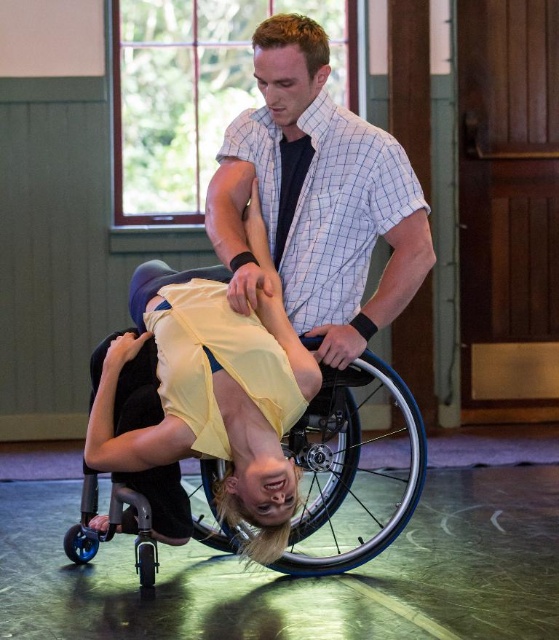
You are a photographer positioned at the entrance of the dance studio. You need to capture a photo of the white checkered shirt at center without including the wheelchair in the frame. Based on their positions, is this possible?

The white checkered shirt at center is located at point (316, 196), so yes, the photographer can position themselves in a way that frames the white checkered shirt at center while excluding the wheelchair from the shot by adjusting the angle or zoom.

You are a photographer setting up a shot in the dance studio. You want to ensure both the white checkered shirt at center and the black plastic wheelchair at center are in frame. Given that your camera has a fixed focal length, which object should you prioritize framing closer to the center to accommodate their sizes?

The white checkered shirt at center has a lesser width compared to the black plastic wheelchair at center, so you should prioritize framing the black plastic wheelchair at center closer to the center to account for its larger size.

You are a physical therapist in a dance studio. You need to move a medical supply cart from the wooden door on the right to the area near the white checkered shirt at center and the black plastic wheelchair at center. Which object should you position the cart closer to so that it is between the two objects?

The cart should be positioned closer to the black plastic wheelchair at center because the white checkered shirt at center is to the left of the black plastic wheelchair at center, placing the cart between them would require it to be near the wheelchair side.